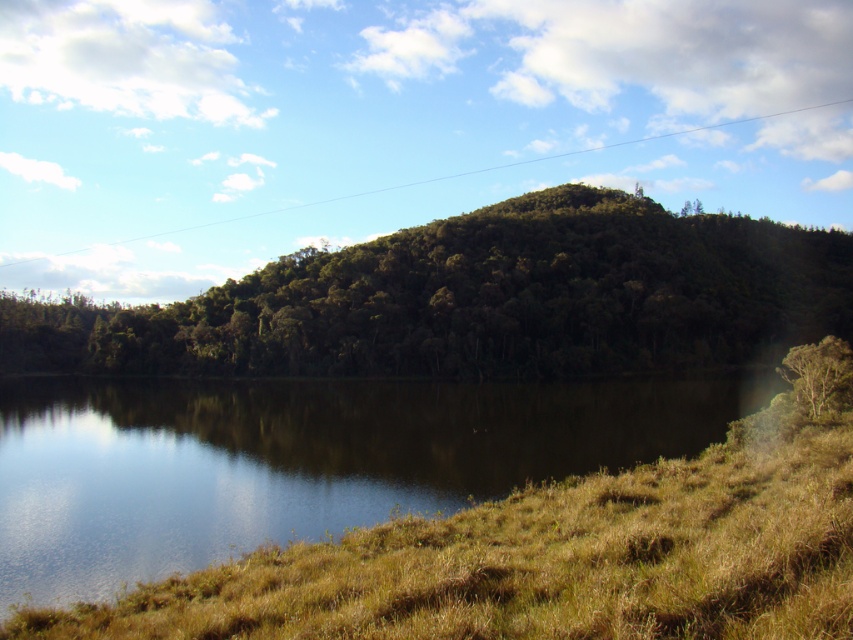
Question: Does green grassy water at lower left come in front of green leafy tree at right?

Choices:
 (A) no
 (B) yes

Answer: (B)

Question: Which is nearer to the green grassy water at lower left?

Choices:
 (A) green leafy tree at right
 (B) green leafy tree at center

Answer: (B)

Question: Which point is closer to the camera taking this photo?

Choices:
 (A) (811, 314)
 (B) (801, 353)
 (C) (225, 412)

Answer: (B)

Question: Does green grassy water at lower left have a greater width compared to green leafy tree at right?

Choices:
 (A) yes
 (B) no

Answer: (A)

Question: Can you confirm if green grassy water at lower left is positioned above green leafy tree at center?

Choices:
 (A) no
 (B) yes

Answer: (A)

Question: Which of the following is the farthest from the observer?

Choices:
 (A) green leafy tree at right
 (B) green grassy water at lower left

Answer: (A)